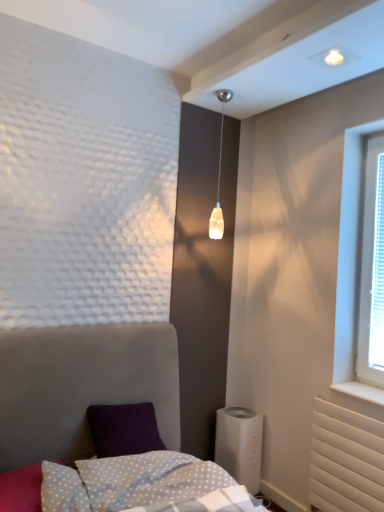
Identify the location of vacant area on top of white dotted fabric pillow at lower left (from a real-world perspective). This screenshot has height=512, width=384. (36, 479).